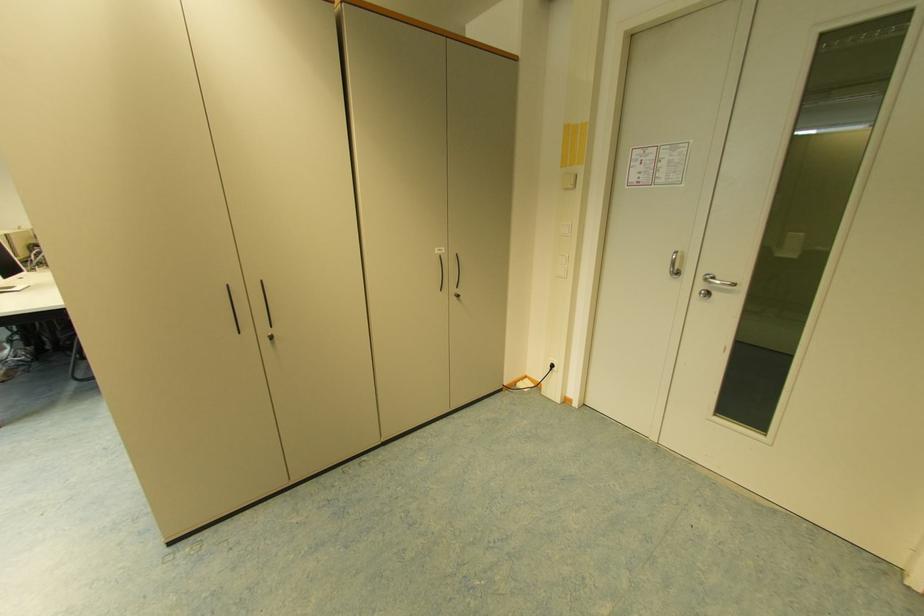
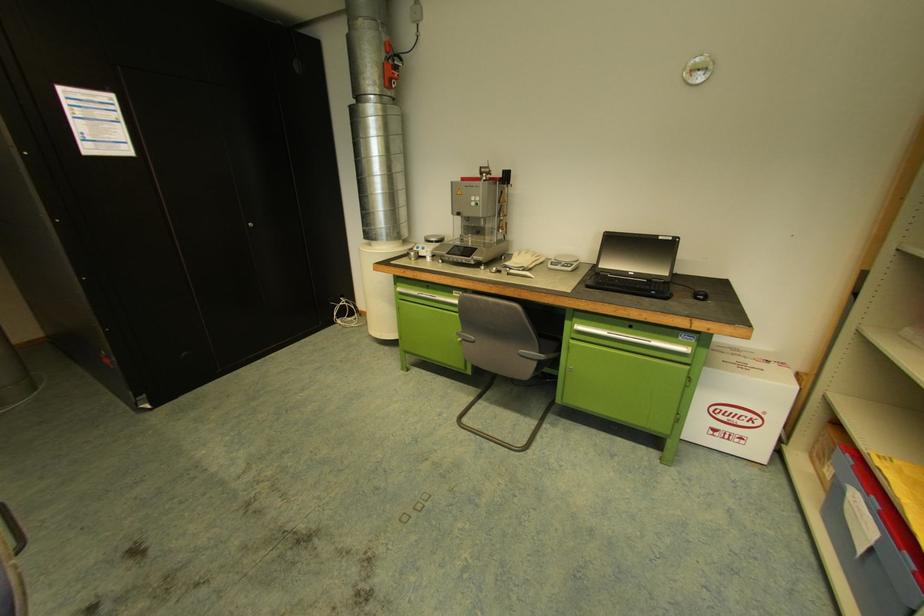
What movement of the cameraman would produce the second image?

The cameraman moved toward left, forward.